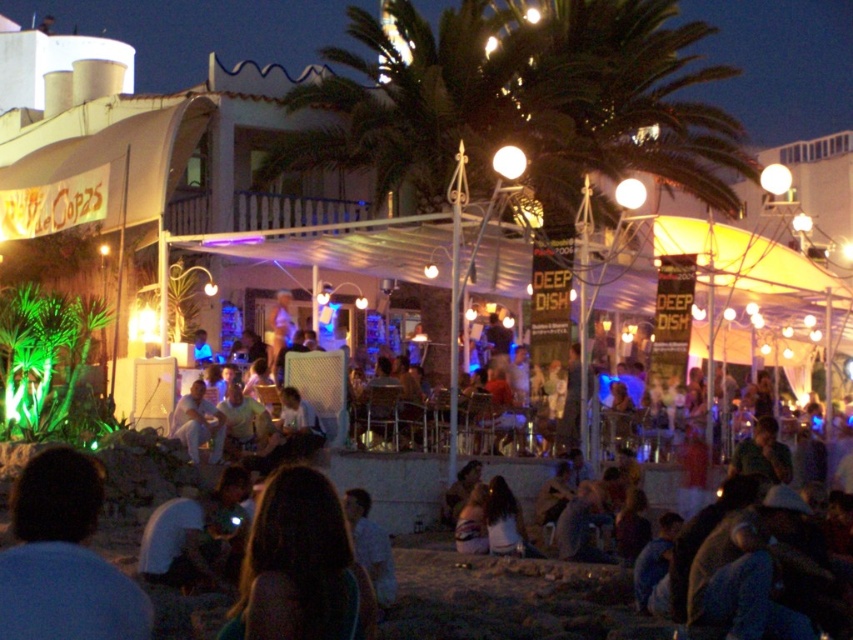
Who is more forward, (7,586) or (230,637)?

Point (7,586) is in front.

Between point (61, 614) and point (326, 541), which one is positioned behind?

Positioned behind is point (326, 541).

Locate an element on the screen. This screenshot has height=640, width=853. blue fabric shirt at lower left is located at coordinates (62, 557).